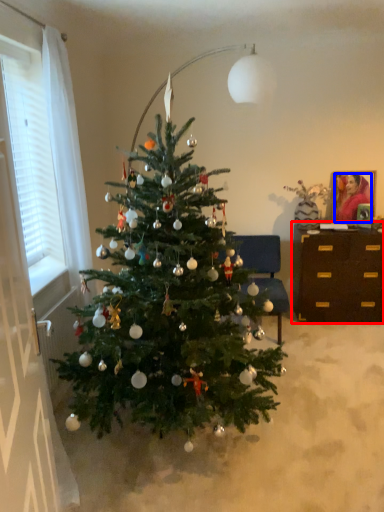
Question: Which object appears farthest to the camera in this image, desk (highlighted by a red box) or person (highlighted by a blue box)?

Choices:
 (A) desk
 (B) person

Answer: (B)